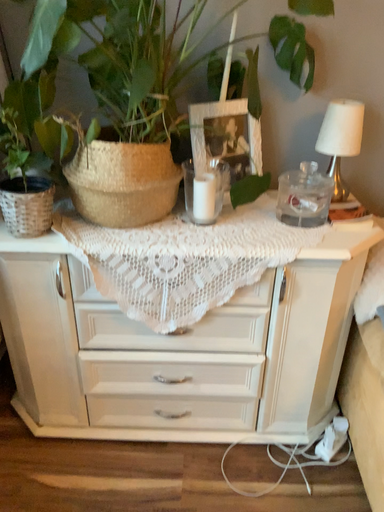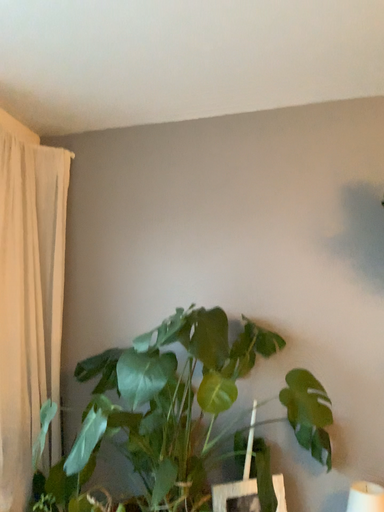
Question: How did the camera likely rotate when shooting the video?

Choices:
 (A) rotated downward
 (B) rotated upward

Answer: (B)